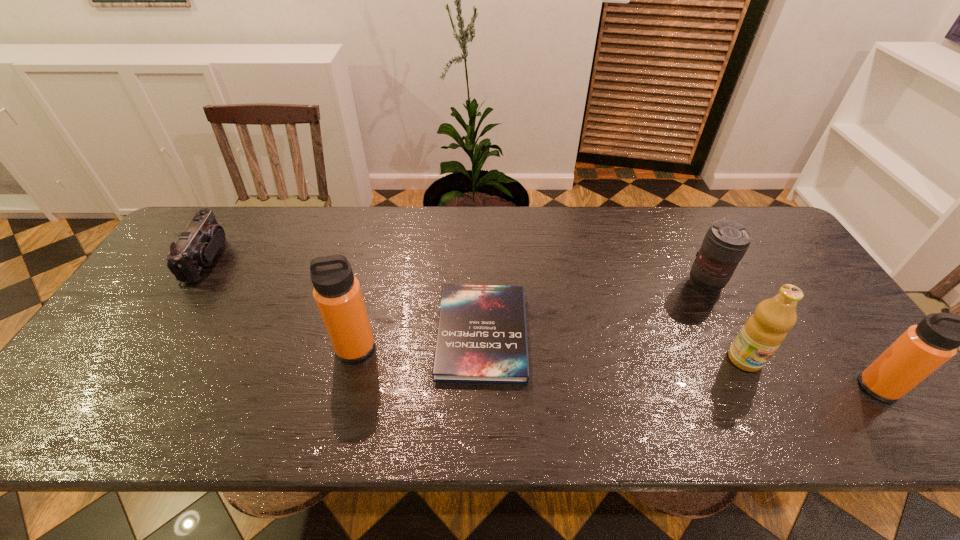
You are a GUI agent. You are given a task and a screenshot of the screen. Output one action in this format:
    pyautogui.click(x=<x>, y=<y>)
    Task: Click on the vacant area that lies between the farther thermos bottle and the rightmost object
    The height and width of the screenshot is (540, 960).
    Given the screenshot: What is the action you would take?
    pyautogui.click(x=616, y=367)

Where is `free area in between the fifth tallest object and the taller thermos bottle`? Image resolution: width=960 pixels, height=540 pixels. free area in between the fifth tallest object and the taller thermos bottle is located at coordinates (281, 303).

You are a GUI agent. You are given a task and a screenshot of the screen. Output one action in this format:
    pyautogui.click(x=<x>, y=<y>)
    Task: Click on the free area in between the fourth tallest object and the olive oil
    This screenshot has height=540, width=960.
    Given the screenshot: What is the action you would take?
    pyautogui.click(x=725, y=322)

The image size is (960, 540). In order to click on vacant space in between the farther thermos bottle and the olive oil in this screenshot , I will do `click(550, 353)`.

Locate an element on the screen. free point between the right thermos bottle and the olive oil is located at coordinates (811, 373).

The height and width of the screenshot is (540, 960). Find the location of `free point between the olive oil and the taller thermos bottle`. free point between the olive oil and the taller thermos bottle is located at coordinates (550, 353).

Locate an element on the screen. Image resolution: width=960 pixels, height=540 pixels. vacant region between the second object from left to right and the nearer thermos bottle is located at coordinates (616, 367).

The height and width of the screenshot is (540, 960). Find the location of `blank region between the second shortest object and the telephoto lens`. blank region between the second shortest object and the telephoto lens is located at coordinates [456, 271].

Locate an element on the screen. This screenshot has width=960, height=540. object that is the fifth nearest to the second object from left to right is located at coordinates (922, 349).

Locate an element on the screen. The width and height of the screenshot is (960, 540). the third closest object to the fourth object from right to left is located at coordinates (764, 331).